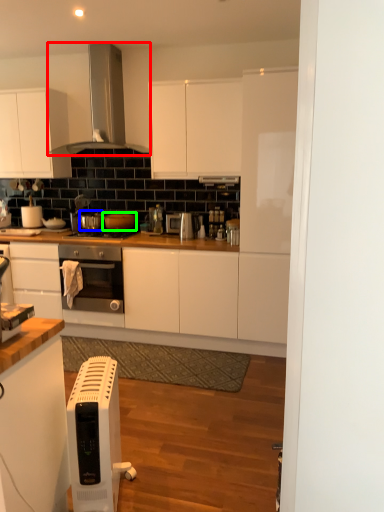
Question: Considering the real-world distances, which object is closest to kitchen appliance (highlighted by a red box)? appliance (highlighted by a blue box) or appliance (highlighted by a green box).

Choices:
 (A) appliance
 (B) appliance

Answer: (B)